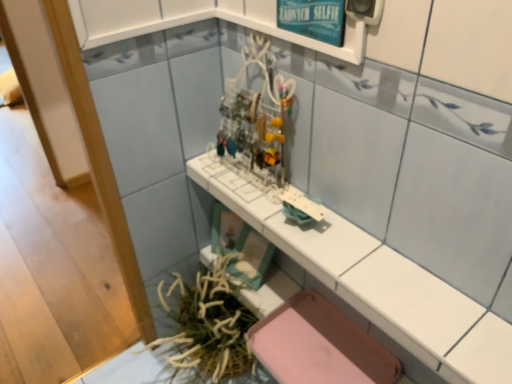
Where is `free space above white glossy counter top at center (from a real-world perspective)`? free space above white glossy counter top at center (from a real-world perspective) is located at coordinates (324, 236).